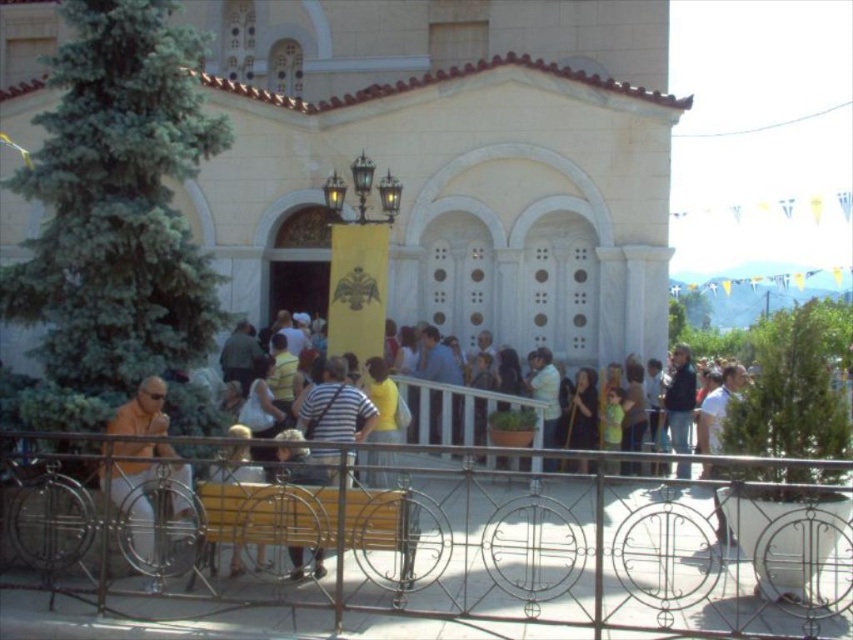
You are a photographer standing at the entrance of the church. You want to take a photo of the white cotton shirt at center. Is the subject within your camera lens range? The camera has a maximum zoom of 50 meters.

The white cotton shirt at center is 41.39 meters away from the camera. Since the camera can zoom up to 50 meters, the subject is within range and can be captured clearly.

You are standing at the entrance of the church and want to sit down on the wooden bench at lower center. Based on your position, is the bench to your left, right, or directly in front of you?

The wooden bench at lower center is located at point coordinates, but without specific spatial orientation details, we can infer from the description that it is at the lower center of the image. Since you are at the entrance facing outward, the bench would be directly in front of you.

You are standing at the entrance of the church and see the orange fabric shirt at left and a camera. Which object is closer to you?

The orange fabric shirt at left is closer to you because it is only 41.43 meters away from the camera, which is farther away.